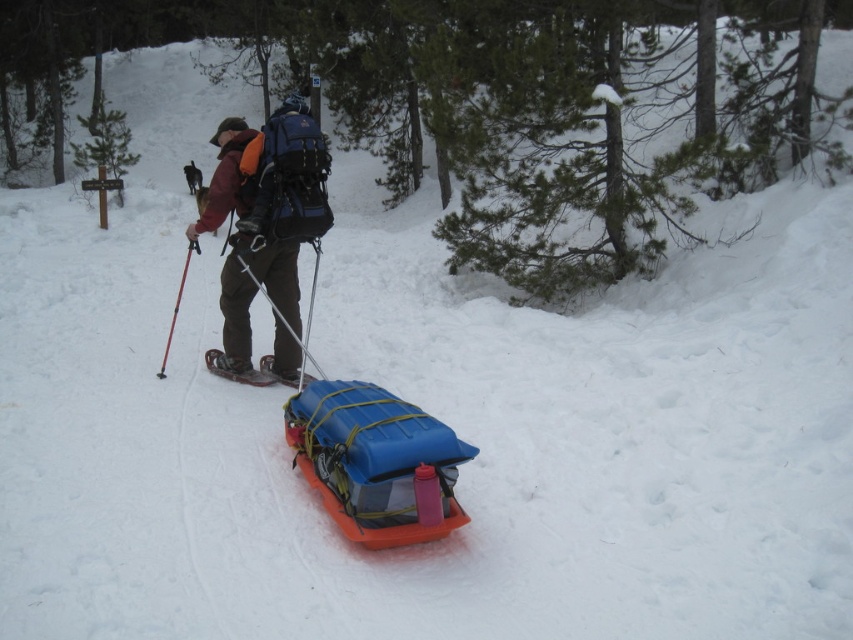
You are a hiker planning to place a red first aid kit on your sled. The sled is located at point [248,310]. The sled is orange with a blue container and yellow straps. Where should you place the red first aid kit so it doesn not fall off the sled?

Place the red first aid kit on the sled at point [248,310], securing it with the existing yellow straps to prevent it from falling off.

You are the hiker in the snowy scene. You need to adjust your gear. Which item, the matte black backpack at center or the metallic snowshoe at center, should you adjust first if you want to reach the taller one without bending down?

The matte black backpack at center is much taller than the metallic snowshoe at center, so you should adjust the matte black backpack at center first since it is taller and more accessible without bending down.

You are a hiker planning to set up a tent in this snowy area. You have two potential spots marked as point 1 at coordinates point (224, 156) and point 2 at coordinates point (233, 371). Considering the terrain, which point is more suitable for setting up the tent because it is closer to you?

Point 1 at coordinates point (224, 156) is closer to the viewer than point 2 at coordinates point (233, 371), so it is more suitable for setting up the tent because it is closer.